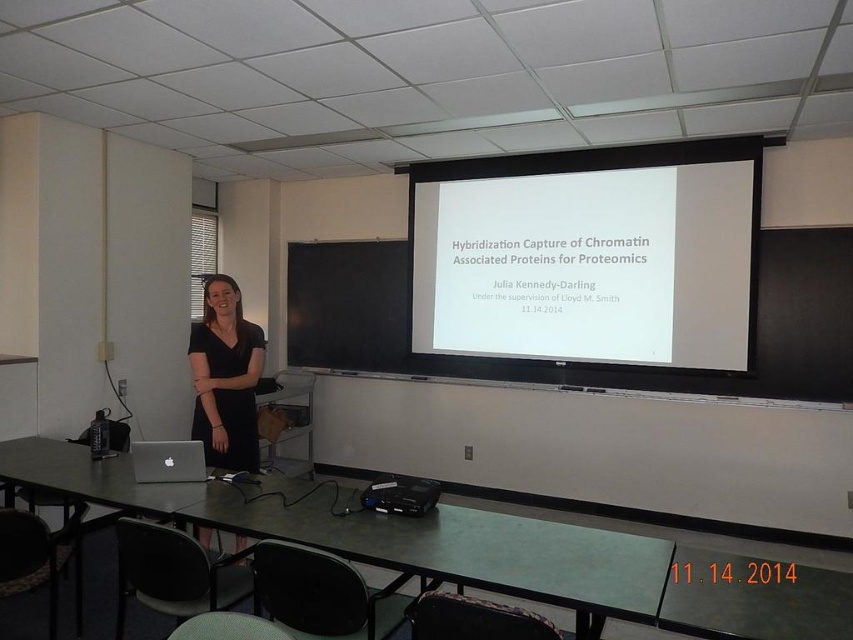
You are a student sitting at the back of the classroom. You notice two points marked on the floor. The first point is at coordinate point(15, 483) and the second point is at coordinate point(229, 396). Which point is closer to the front of the classroom?

Point(15, 483) is closer to the front of the classroom because it is in front of point(229, 396).

You are a student sitting in the classroom and want to see the presenter and the screen clearly. Which object is located above the other between the white matte projection screen at upper center and the black plastic projector at center?

The white matte projection screen at upper center is positioned over the black plastic projector at center, so the screen is above the projector.

You are sitting in the front row of the classroom and want to hand the presenter a note. Since you can only reach the green plastic table at center and the black matte dress at center, which object can you place the note on?

The green plastic table at center is closer to the viewer than the black matte dress at center, so you can place the note on the green plastic table at center.